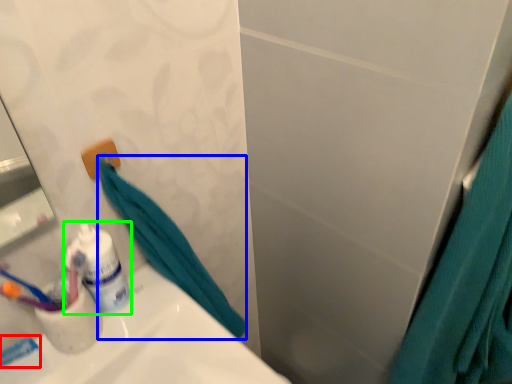
Question: Which object is the closest to the toothpaste (highlighted by a red box)? Choose among these: bath towel (highlighted by a blue box) or toiletry (highlighted by a green box).

Choices:
 (A) bath towel
 (B) toiletry

Answer: (B)